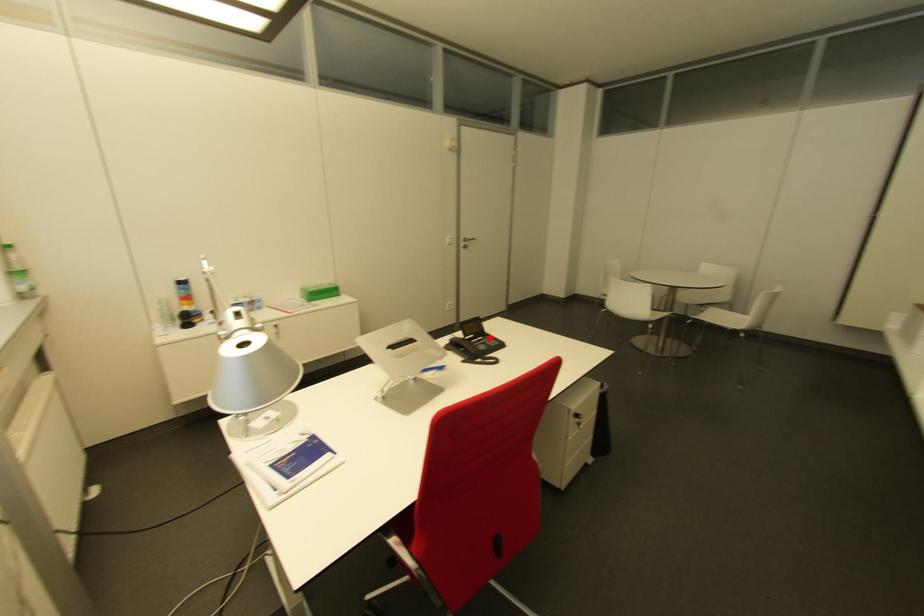
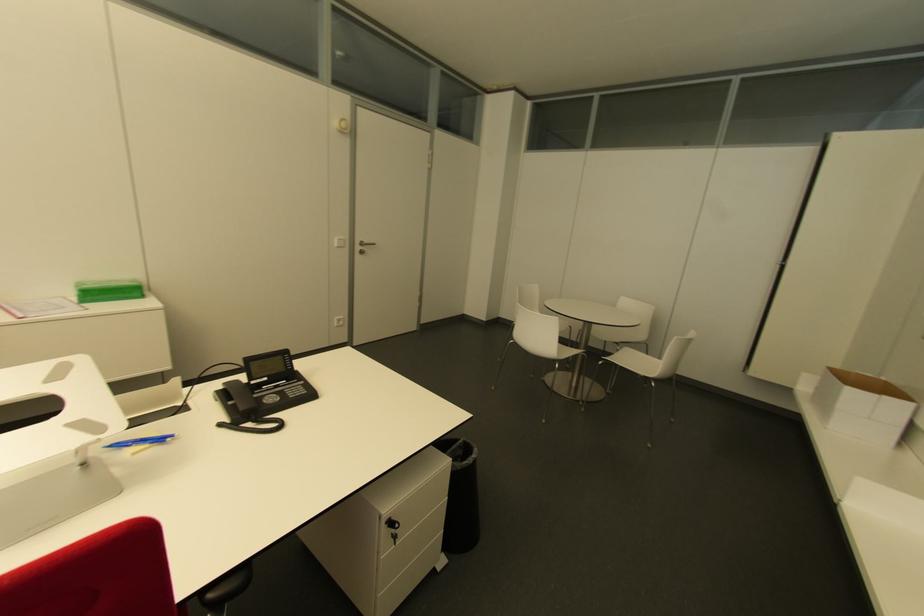
Locate, in the second image, the point that corresponds to the highlighted location in the first image.

(299, 383)